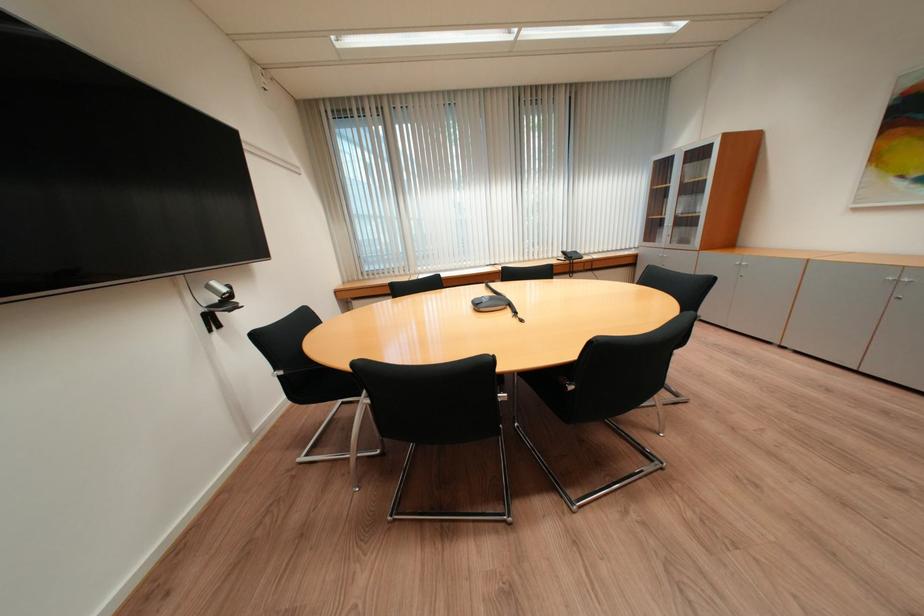
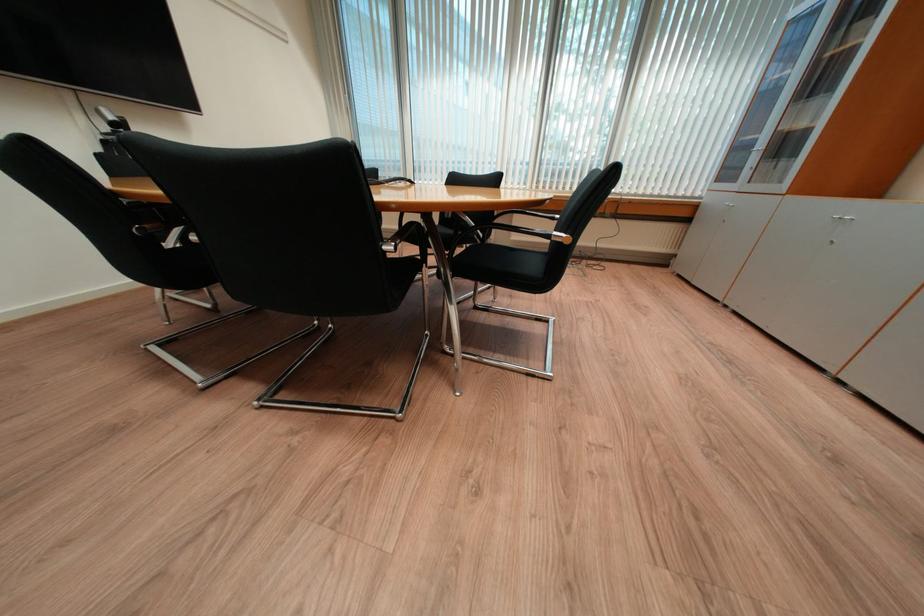
In a continuous first-person perspective shot, in which direction is the camera moving?

The cameraman walked toward right, forward.